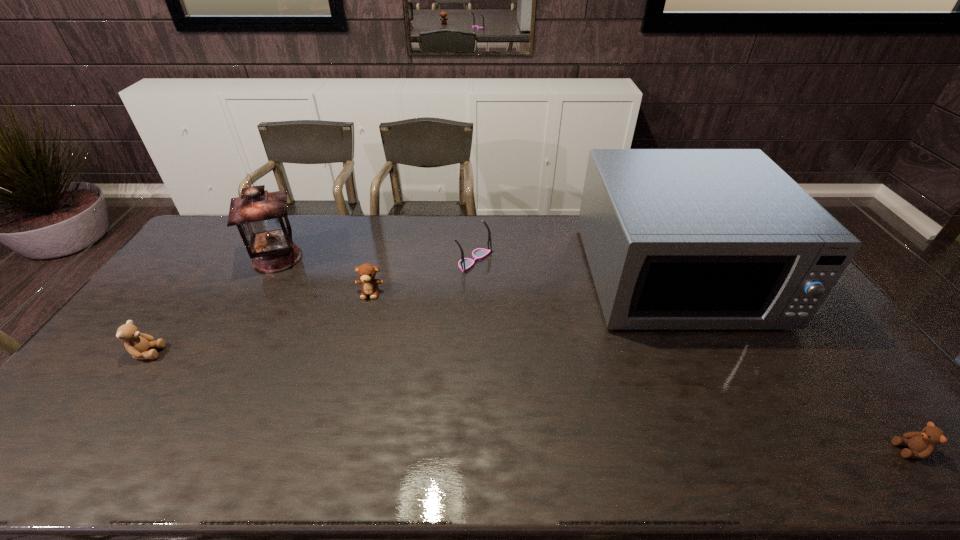
Identify the location of object that is at the near edge. This screenshot has height=540, width=960. (922, 444).

Where is `object that is at the left edge`? The width and height of the screenshot is (960, 540). object that is at the left edge is located at coordinates (138, 344).

I want to click on microwave oven that is positioned at the right edge, so click(675, 238).

The height and width of the screenshot is (540, 960). Identify the location of teddy bear present at the right edge. (922, 444).

At what (x,y) coordinates should I click in order to perform the action: click on object that is positioned at the far right corner. Please return your answer as a coordinate pair (x, y). This screenshot has width=960, height=540. Looking at the image, I should click on (675, 238).

Locate an element on the screen. Image resolution: width=960 pixels, height=540 pixels. object present at the near right corner is located at coordinates [922, 444].

At what (x,y) coordinates should I click in order to perform the action: click on vacant area at the far edge of the desktop. Please return your answer as a coordinate pair (x, y). This screenshot has height=540, width=960. Looking at the image, I should click on (308, 246).

I want to click on vacant space at the near edge of the desktop, so click(246, 443).

In the image, there is a desktop. In order to click on vacant space at the right edge in this screenshot , I will do `click(832, 333)`.

In order to click on free space between the third object from right to left and the fifth object from left to right in this screenshot , I will do `click(575, 268)`.